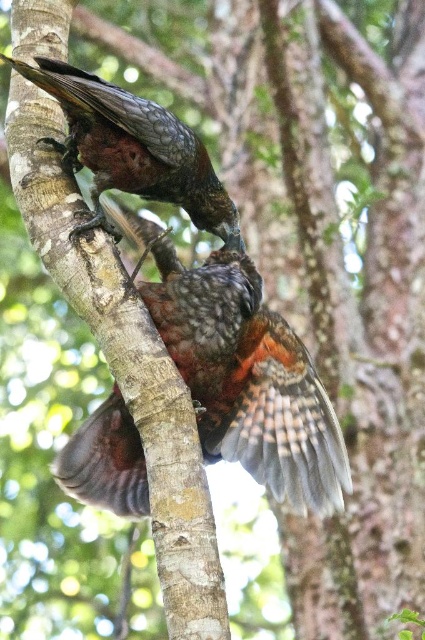
Which is behind, point (88, 440) or point (136, 113)?

The point (88, 440) is more distant.

Is shiny brown feathers at center in front of shiny brown feathers at upper center?

That is False.

Is point (170, 340) closer to viewer compared to point (144, 152)?

That is False.

Locate an element on the screen. The image size is (425, 640). shiny brown feathers at center is located at coordinates (249, 380).